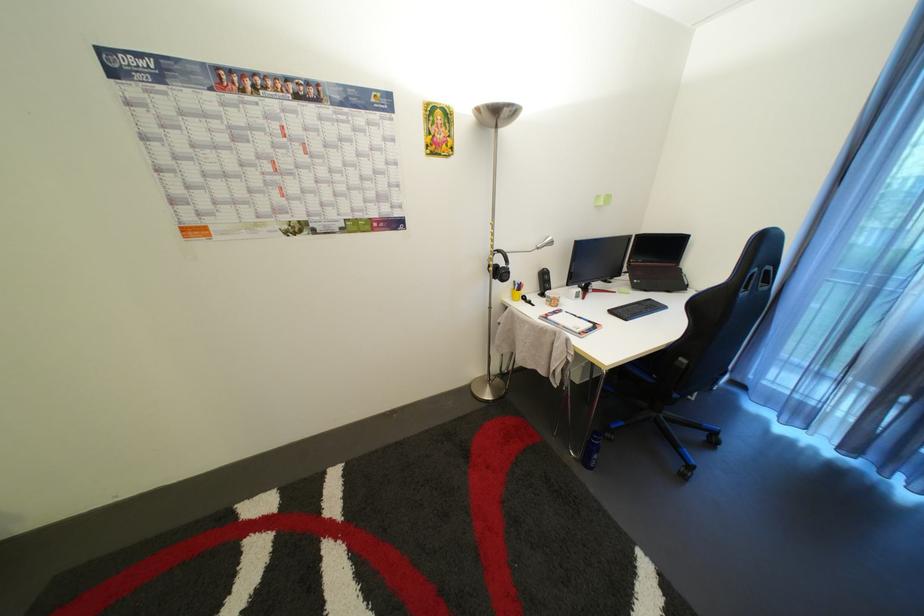
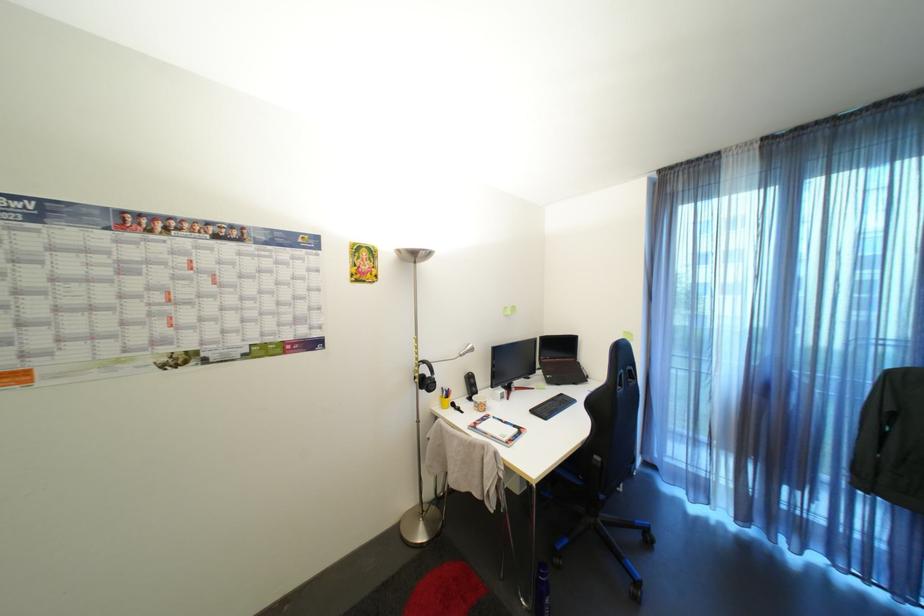
How did the camera likely rotate?

The camera's rotation is toward right-up.